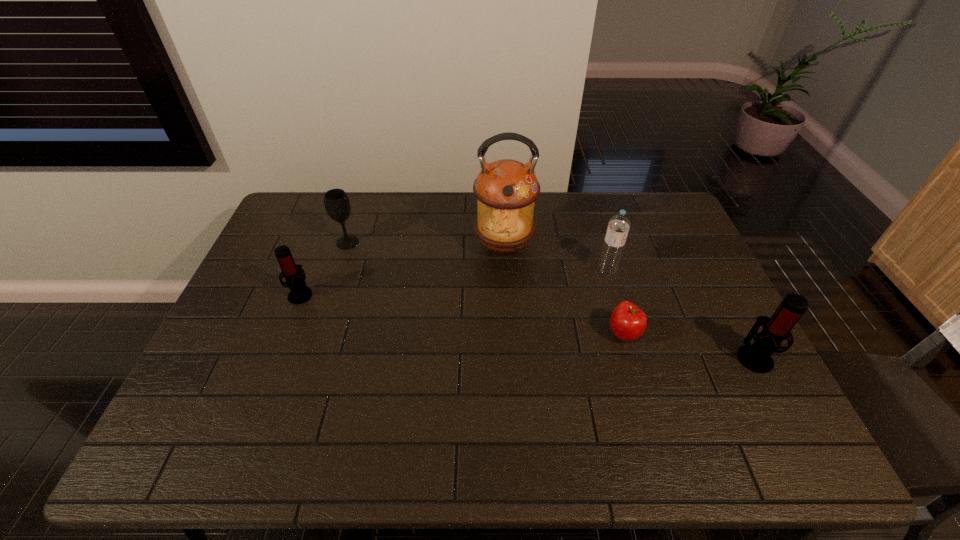
Find the location of `vacant space at the left edge of the desktop`. vacant space at the left edge of the desktop is located at coordinates (276, 308).

You are a GUI agent. You are given a task and a screenshot of the screen. Output one action in this format:
    pyautogui.click(x=<x>, y=<y>)
    Task: Click on the vacant space at the right edge of the desktop
    This screenshot has width=960, height=540.
    Given the screenshot: What is the action you would take?
    pyautogui.click(x=676, y=262)

The image size is (960, 540). What are the coordinates of `free space at the near left corner` in the screenshot? It's located at (198, 387).

The height and width of the screenshot is (540, 960). Identify the location of blank space at the far right corner of the desktop. (658, 210).

At what (x,y) coordinates should I click in order to perform the action: click on free space between the right microphone and the shortest object. Please return your answer as a coordinate pair (x, y). Image resolution: width=960 pixels, height=540 pixels. Looking at the image, I should click on (688, 345).

Identify the location of free area in between the farther microphone and the taller microphone. (527, 325).

You are a GUI agent. You are given a task and a screenshot of the screen. Output one action in this format:
    pyautogui.click(x=<x>, y=<y>)
    Task: Click on the free spot between the shortest object and the wineglass
    The image size is (960, 540).
    Given the screenshot: What is the action you would take?
    pyautogui.click(x=486, y=288)

What are the coordinates of `blank region between the second object from left to right and the rightmost object` in the screenshot? It's located at (550, 299).

Identify the location of blank region between the water bottle and the left microphone. Image resolution: width=960 pixels, height=540 pixels. (454, 282).

The height and width of the screenshot is (540, 960). Identify the location of vacant space that is in between the fourth object from right to left and the apple. [x=564, y=290].